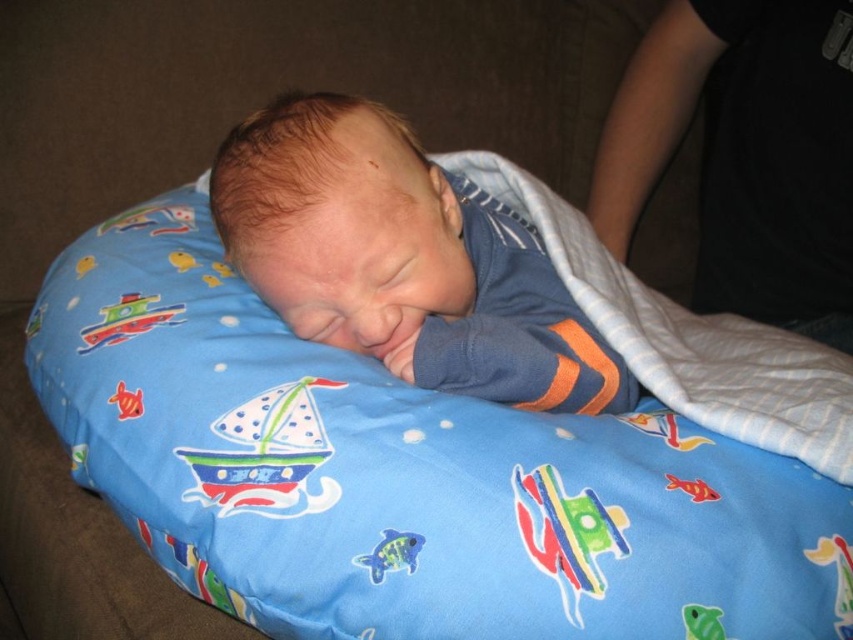
Question: Does blue soft fabric baby at center appear on the right side of blue soft fabric at center?

Choices:
 (A) yes
 (B) no

Answer: (B)

Question: Among these objects, which one is nearest to the camera?

Choices:
 (A) blue soft fabric baby at center
 (B) blue soft fabric at center
 (C) black cotton sleeve at upper right

Answer: (B)

Question: Which object is positioned farthest from the blue soft fabric at center?

Choices:
 (A) black cotton sleeve at upper right
 (B) blue soft fabric baby at center

Answer: (A)

Question: Which object is positioned closest to the black cotton sleeve at upper right?

Choices:
 (A) blue soft fabric at center
 (B) blue soft fabric baby at center

Answer: (A)

Question: Is black cotton sleeve at upper right further to the viewer compared to blue soft fabric at center?

Choices:
 (A) no
 (B) yes

Answer: (B)

Question: Is blue soft fabric baby at center bigger than black cotton sleeve at upper right?

Choices:
 (A) no
 (B) yes

Answer: (A)